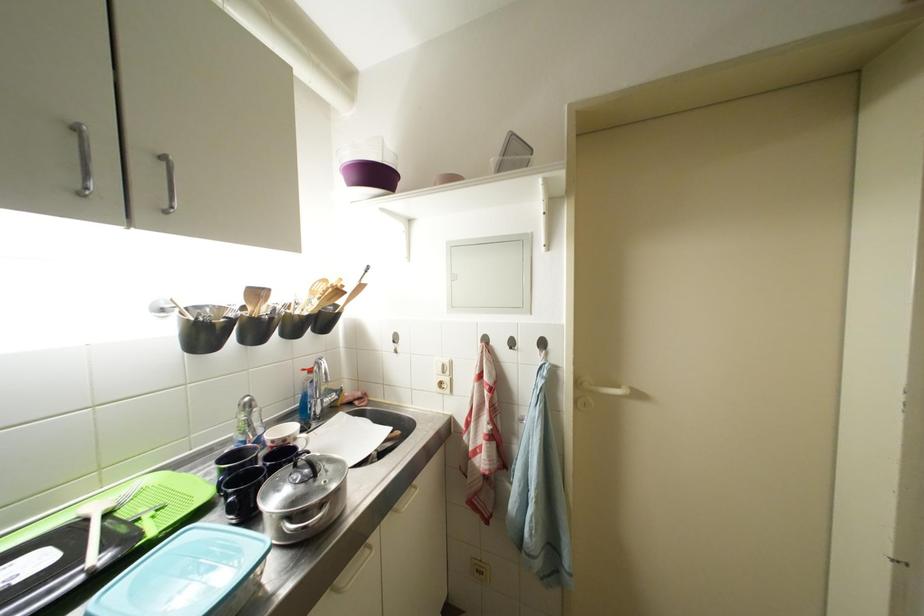
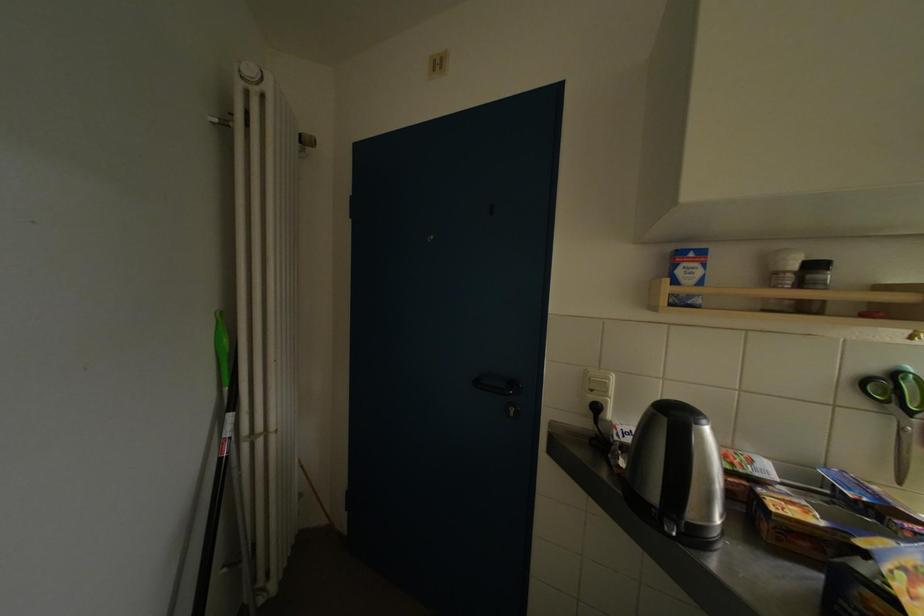
Question: The images are taken continuously from a first-person perspective. In which direction is your viewpoint rotating?

Choices:
 (A) Left
 (B) Right
 (C) Up
 (D) Down

Answer: (A)